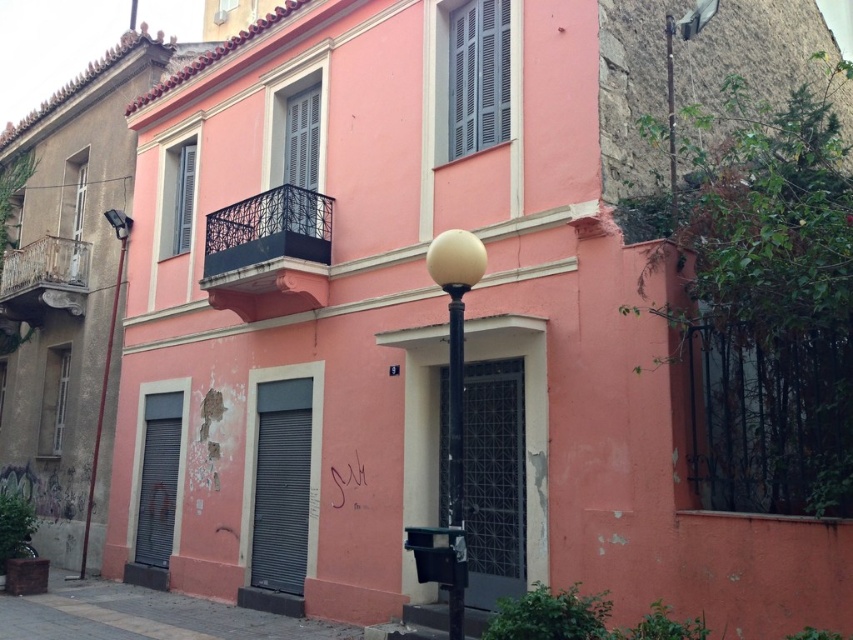
Who is higher up, black wrought iron balcony at upper center or metallic pole at left?

black wrought iron balcony at upper center

Is black wrought iron balcony at upper center positioned before metallic pole at left?

Yes, it is in front of metallic pole at left.

Is point (308, 269) less distant than point (117, 284)?

Yes, point (308, 269) is in front of point (117, 284).

The height and width of the screenshot is (640, 853). In order to click on black wrought iron balcony at upper center in this screenshot , I will do tap(265, 240).

Which is behind, point (62, 614) or point (67, 243)?

Positioned behind is point (67, 243).

Which of these two, brick pavement at lower left or rusty metal balcony at upper left, stands shorter?

Standing shorter between the two is brick pavement at lower left.

Identify the location of brick pavement at lower left. The width and height of the screenshot is (853, 640). (144, 616).

Is point (9, 308) positioned in front of point (86, 504)?

No, (9, 308) is behind (86, 504).

Does point (15, 275) come in front of point (107, 340)?

No, it is behind (107, 340).

Image resolution: width=853 pixels, height=640 pixels. What are the coordinates of `rusty metal balcony at upper left` in the screenshot? It's located at (44, 278).